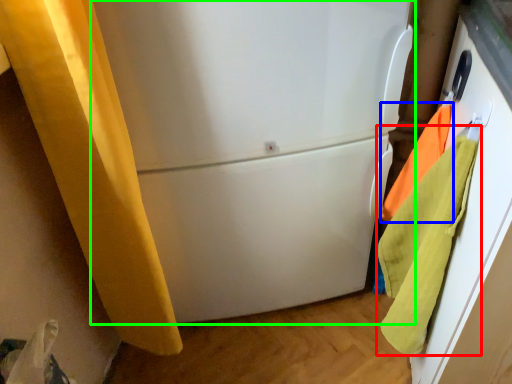
Question: Which is nearer to the beach towel (highlighted by a red box)? beach towel (highlighted by a blue box) or refrigerator (highlighted by a green box).

Choices:
 (A) beach towel
 (B) refrigerator

Answer: (A)